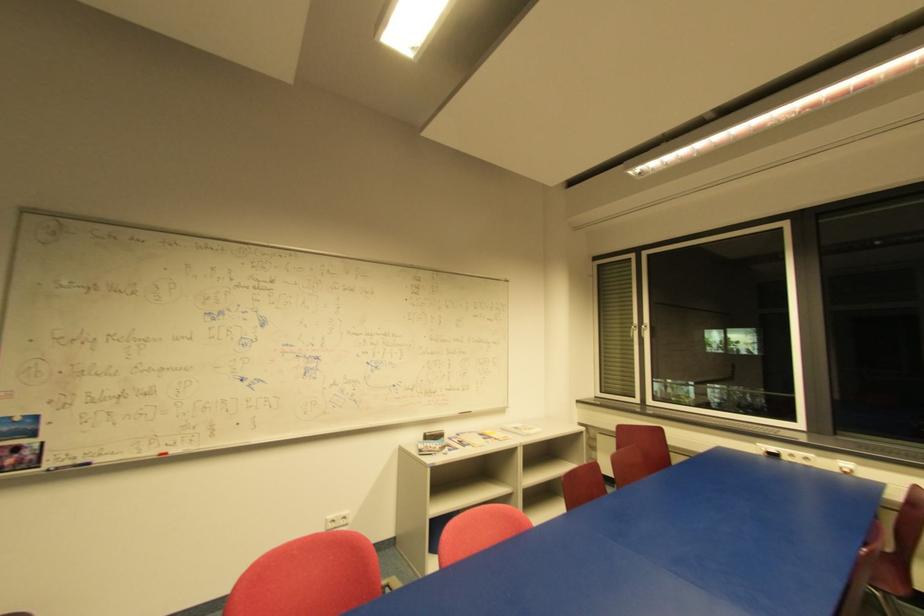
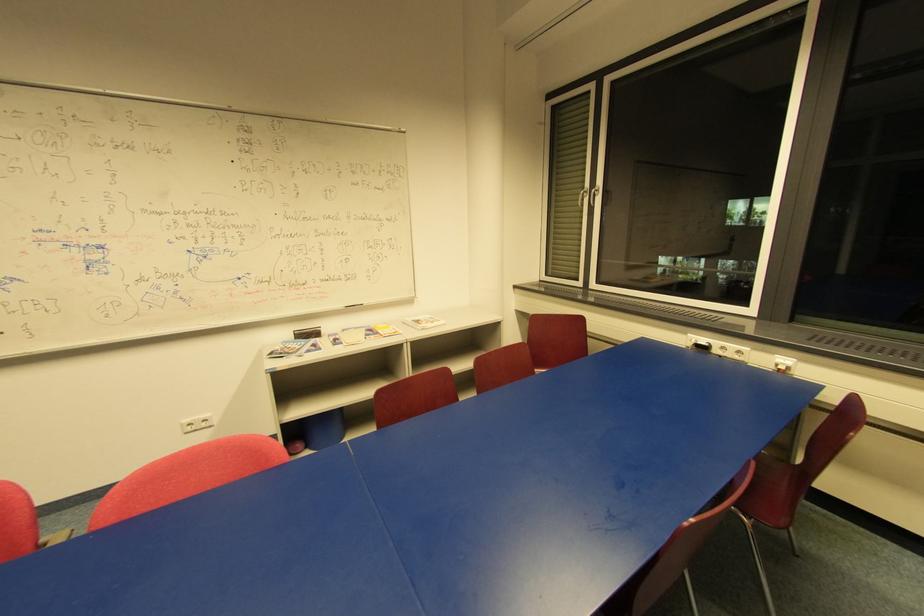
The point at (458, 413) is marked in the first image. Where is the corresponding point in the second image?

(344, 307)